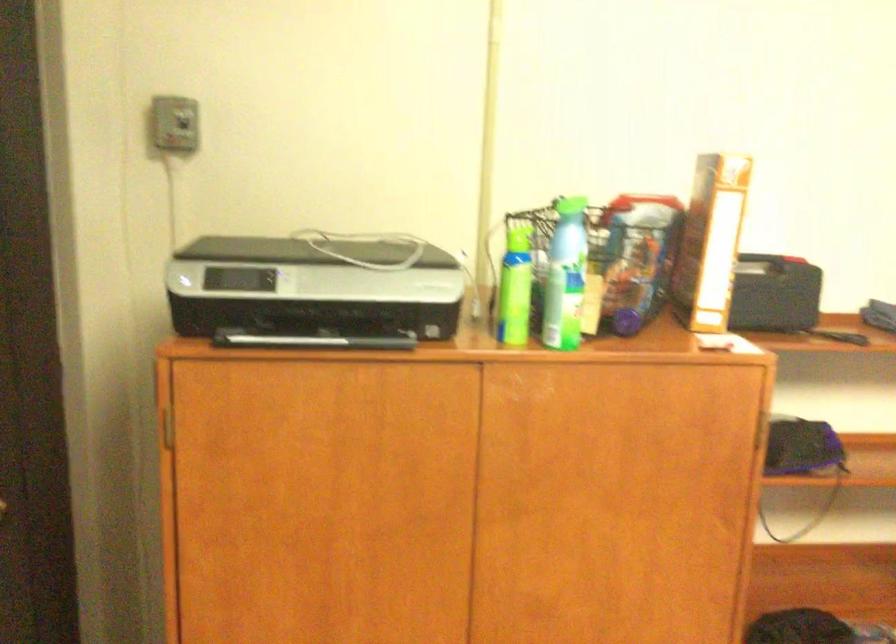
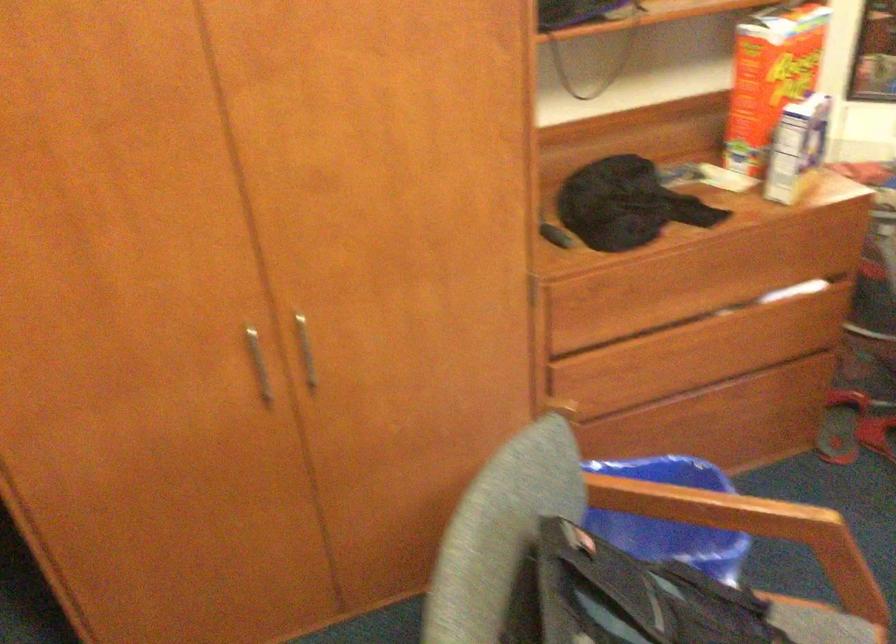
Question: How did the camera likely rotate?

Choices:
 (A) Left
 (B) Right
 (C) Up
 (D) Down

Answer: (D)